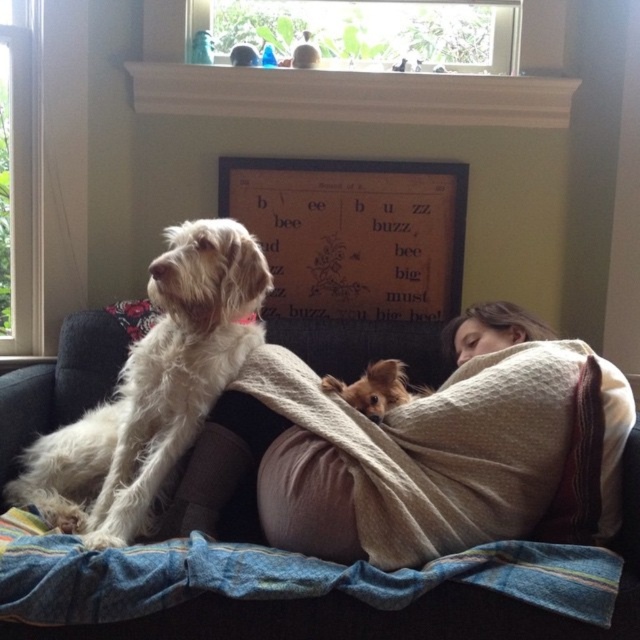
Describe the element at coordinates (420, 451) in the screenshot. This screenshot has width=640, height=640. I see `beige knitted blanket at center` at that location.

Does beige knitted blanket at center lie in front of denim fabric blanket at lower center?

No, beige knitted blanket at center is further to the viewer.

Find the location of a particular element. The image size is (640, 640). beige knitted blanket at center is located at coordinates (420, 451).

Which is behind, point (166, 596) or point (477, 621)?

The point (477, 621) is more distant.

Is point (68, 600) in front of point (1, 476)?

That is True.

Is point (250, 593) behind point (179, 616)?

No, it is in front of (179, 616).

Find the location of `denim fabric blanket at lower center`. denim fabric blanket at lower center is located at coordinates (275, 576).

Is the position of beige knitted blanket at center less distant than that of wooden bulletin board at center?

Yes, it is in front of wooden bulletin board at center.

Is beige knitted blanket at center smaller than wooden bulletin board at center?

No.

Is point (465, 392) farther from camera compared to point (372, 164)?

No, (465, 392) is in front of (372, 164).

I want to click on beige knitted blanket at center, so click(420, 451).